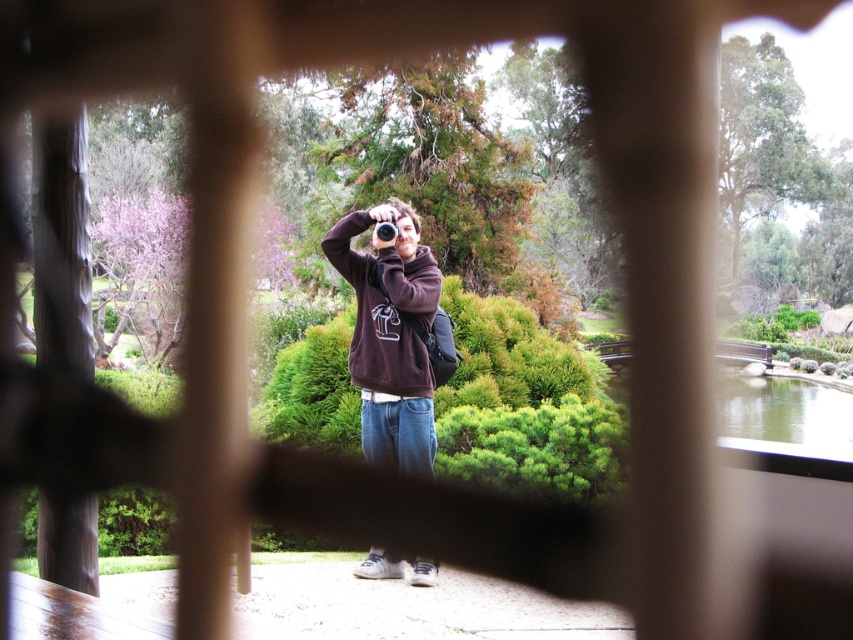
You are a photographer trying to capture the perfect shot. You notice the brown fleece sweatshirt at center and the black plastic camera at center. Which object is located to the right of the other?

The brown fleece sweatshirt at center is positioned on the right side of black plastic camera at center.

You are standing at the point labeled as point (401, 262) in the image. You want to take a photo of the camera in the scene. Is the camera within your reach to adjust it?

The camera is 17.53 feet away from point (401, 262), so it is too far to reach and adjust.

You are a photographer trying to capture the perfect shot. You notice the brown fleece sweatshirt at center and the black plastic camera at center. Which object should you adjust to ensure the camera is positioned higher than the sweatshirt?

To ensure the black plastic camera at center is positioned higher than the brown fleece sweatshirt at center, you should adjust the black plastic camera at center to move it upwards since the brown fleece sweatshirt at center is currently below the camera.